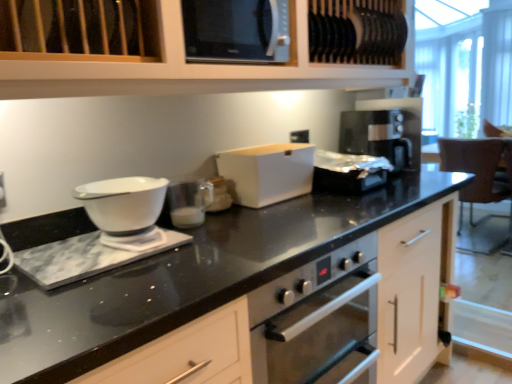
Question: Can you confirm if black glossy microwave at upper center is positioned to the right of white matte cabinet at upper center?

Choices:
 (A) yes
 (B) no

Answer: (B)

Question: From a real-world perspective, does black glossy microwave at upper center sit lower than white matte cabinet at upper center?

Choices:
 (A) yes
 (B) no

Answer: (A)

Question: Is black glossy microwave at upper center not near white matte cabinet at upper center?

Choices:
 (A) no
 (B) yes

Answer: (A)

Question: Is black glossy microwave at upper center thinner than white matte cabinet at upper center?

Choices:
 (A) yes
 (B) no

Answer: (A)

Question: Is black glossy microwave at upper center shorter than white matte cabinet at upper center?

Choices:
 (A) yes
 (B) no

Answer: (A)

Question: Considering the relative positions of black glossy microwave at upper center and white glossy measuring cup at center, which is the 1th appliance in front-to-back order, in the image provided, is black glossy microwave at upper center to the left or to the right of white glossy measuring cup at center, which is the 1th appliance in front-to-back order,?

Choices:
 (A) right
 (B) left

Answer: (A)

Question: Is black glossy microwave at upper center inside or outside of white glossy measuring cup at center, which is the 1th appliance in front-to-back order?

Choices:
 (A) outside
 (B) inside

Answer: (A)

Question: Is point [263, 29] positioned closer to the camera than point [193, 223]?

Choices:
 (A) closer
 (B) farther

Answer: (A)

Question: Looking at their shapes, would you say black glossy microwave at upper center is wider or thinner than white glossy measuring cup at center, which is the 1th appliance in front-to-back order?

Choices:
 (A) thin
 (B) wide

Answer: (B)

Question: From their relative heights in the image, would you say white matte cabinet at upper center is taller or shorter than black glossy microwave at upper center?

Choices:
 (A) tall
 (B) short

Answer: (A)

Question: From the image's perspective, is white matte cabinet at upper center located above or below black glossy microwave at upper center?

Choices:
 (A) above
 (B) below

Answer: (A)

Question: From a real-world perspective, is white matte cabinet at upper center above or below black glossy microwave at upper center?

Choices:
 (A) below
 (B) above

Answer: (B)

Question: Relative to black glossy microwave at upper center, is white matte cabinet at upper center in front or behind?

Choices:
 (A) behind
 (B) front

Answer: (B)

Question: Looking at their shapes, would you say brown leather chair at right is wider or thinner than silver metallic toaster at center, positioned as the third appliance in left-to-right order?

Choices:
 (A) wide
 (B) thin

Answer: (A)

Question: Visually, is brown leather chair at right positioned to the left or to the right of silver metallic toaster at center, which is the 1th appliance from right to left?

Choices:
 (A) left
 (B) right

Answer: (B)